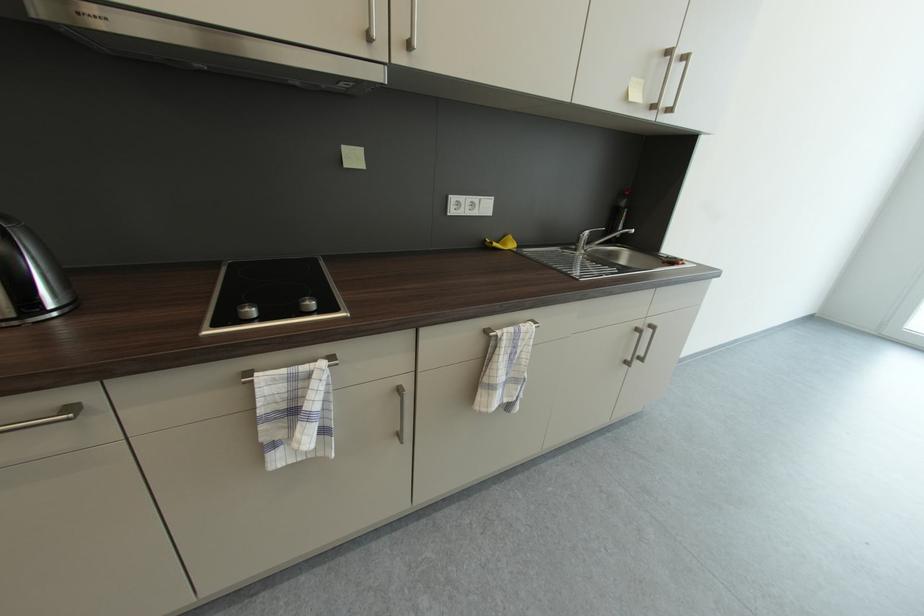
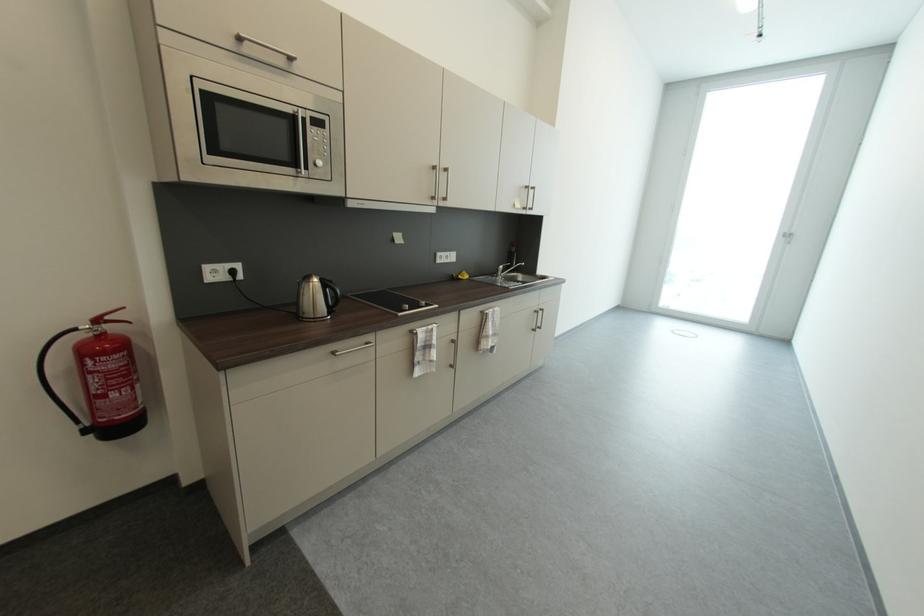
Question: I am providing you with two images of the same scene from different viewpoints. Which of the following objects are not visible in image2?

Choices:
 (A) white door handle
 (B) faucet lever
 (C) fire extinguisher lever
 (D) none of these

Answer: (D)